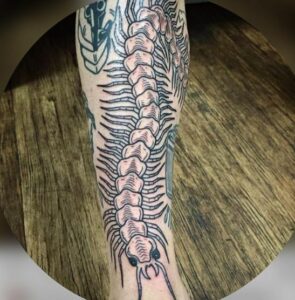
The width and height of the screenshot is (295, 300). I want to click on table, so click(x=235, y=182).